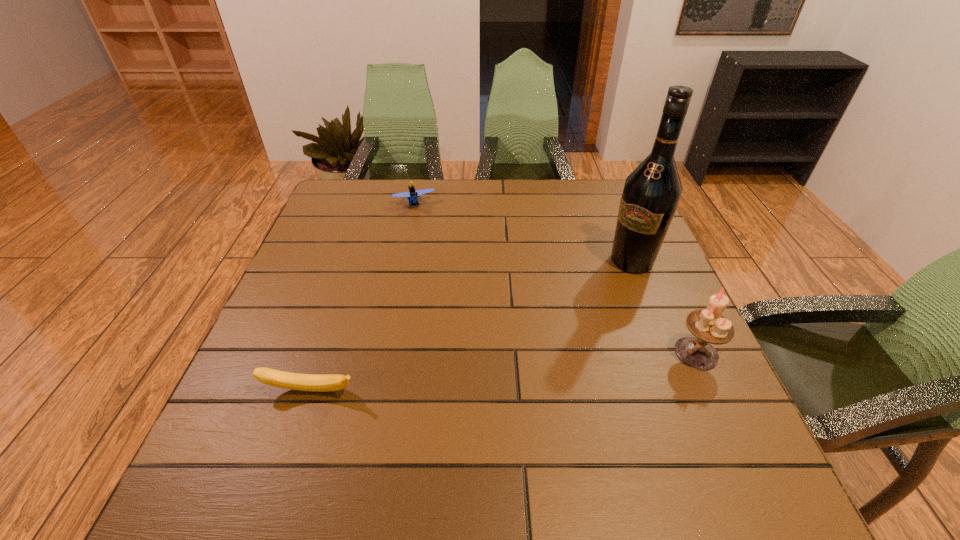
Identify the location of vacant area in the image that satisfies the following two spatial constraints: 1. on the front side of the farthest object; 2. on the right side of the second nearest object. tap(384, 353).

Identify the location of free spot that satisfies the following two spatial constraints: 1. on the front side of the farthest object; 2. on the right side of the third farthest object. This screenshot has height=540, width=960. (384, 353).

Where is `free space that satisfies the following two spatial constraints: 1. on the front side of the third farthest object; 2. on the right side of the farthest object`? This screenshot has width=960, height=540. free space that satisfies the following two spatial constraints: 1. on the front side of the third farthest object; 2. on the right side of the farthest object is located at coordinates (384, 353).

Locate an element on the screen. This screenshot has width=960, height=540. free space that satisfies the following two spatial constraints: 1. on the front side of the third nearest object; 2. on the right side of the candle holder is located at coordinates (668, 353).